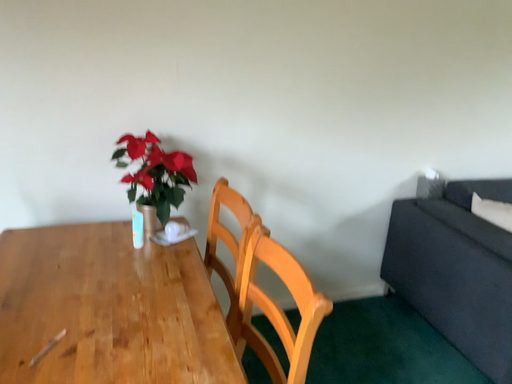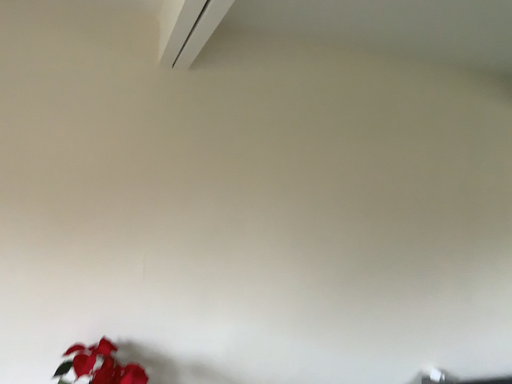
Question: Which way did the camera rotate in the video?

Choices:
 (A) rotated downward
 (B) rotated upward

Answer: (B)